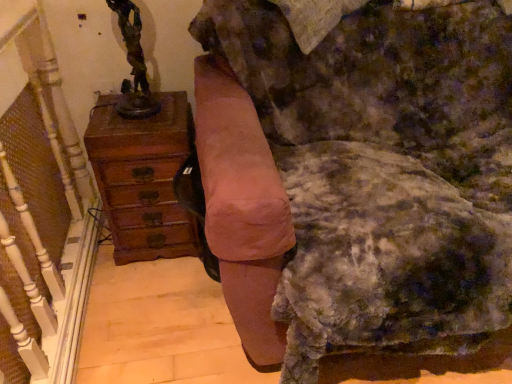
Question: Should I look upward or downward to see bronze statue at upper left?

Choices:
 (A) down
 (B) up

Answer: (B)

Question: From the image's perspective, does bronze statue at upper left appear higher than suede-like pink swivel chair at center?

Choices:
 (A) yes
 (B) no

Answer: (A)

Question: Is bronze statue at upper left wider than suede-like pink swivel chair at center?

Choices:
 (A) yes
 (B) no

Answer: (B)

Question: Could you tell me if bronze statue at upper left is facing suede-like pink swivel chair at center?

Choices:
 (A) yes
 (B) no

Answer: (B)

Question: From a real-world perspective, is bronze statue at upper left located beneath suede-like pink swivel chair at center?

Choices:
 (A) yes
 (B) no

Answer: (B)

Question: Does bronze statue at upper left have a smaller size compared to suede-like pink swivel chair at center?

Choices:
 (A) yes
 (B) no

Answer: (A)

Question: Does bronze statue at upper left have a larger size compared to suede-like pink swivel chair at center?

Choices:
 (A) no
 (B) yes

Answer: (A)

Question: Is suede-like pink swivel chair at center surrounding wooden chest of drawers at left?

Choices:
 (A) yes
 (B) no

Answer: (B)

Question: Is suede-like pink swivel chair at center completely or partially outside of wooden chest of drawers at left?

Choices:
 (A) yes
 (B) no

Answer: (A)

Question: Is suede-like pink swivel chair at center smaller than wooden chest of drawers at left?

Choices:
 (A) yes
 (B) no

Answer: (B)

Question: Does suede-like pink swivel chair at center appear on the right side of wooden chest of drawers at left?

Choices:
 (A) yes
 (B) no

Answer: (A)

Question: Is suede-like pink swivel chair at center directly adjacent to wooden chest of drawers at left?

Choices:
 (A) yes
 (B) no

Answer: (B)

Question: Would you say suede-like pink swivel chair at center is a long distance from wooden chest of drawers at left?

Choices:
 (A) no
 (B) yes

Answer: (A)

Question: Is velvet pink armchair at center wider than wooden chest of drawers at left?

Choices:
 (A) no
 (B) yes

Answer: (B)